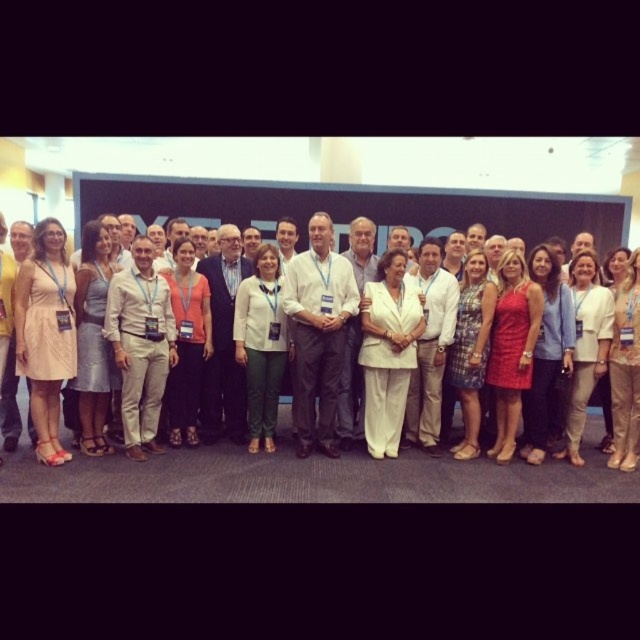
You are organizing a photo shoot and need to arrange two white outfits in a group photo. The outfits are the white cotton dress at center and the white fabric suit at center. According to the scene, which outfit is on the left side?

The white cotton dress at center is positioned on the left side of the white fabric suit at center.

Consider the image. You are a photographer at the event and want to ensure that both the white cotton dress at center and the white fabric suit at center are clearly visible in the photo. Since they are both white, how might their positions affect the visibility of each in the final image?

The white cotton dress at center is positioned under the white fabric suit at center. This placement means the dress may be partially obscured or less visible if the suit is in front of it, so adjusting their positions could help ensure both are clearly seen.